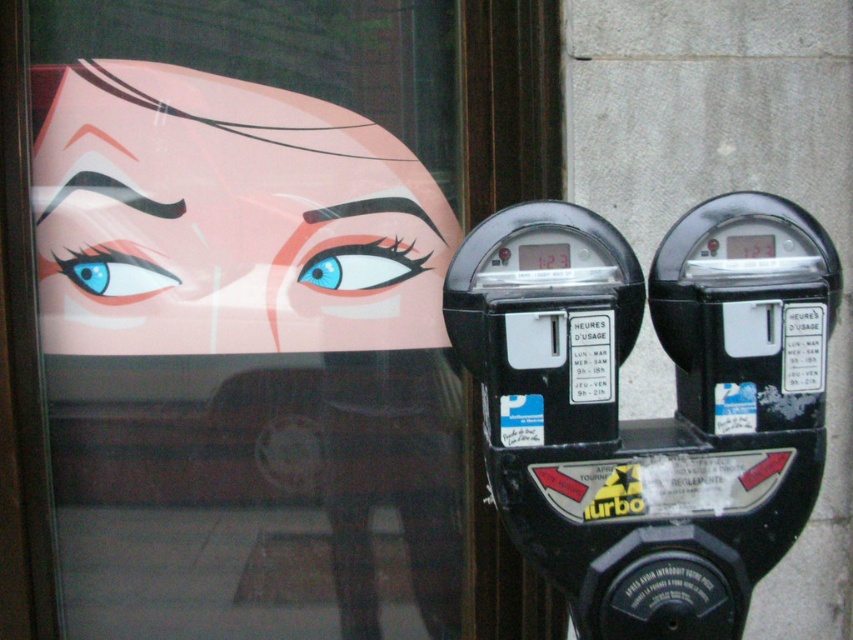
You are a delivery driver who needs to park between two black parking meters positioned side by side against a wall. The meters have digital displays showing 123 remaining. The meters also have a sticker with a blue P symbol and one with the word turbo. The transparent glass at upper left is between them. Can your 2.5 meter long van fit between them?

The distance between the two black parking meters positioned side by side against a wall is 2.69 meters, so yes, the van can fit as it is shorter than the space available.

You are a driver trying to park your car. You see the black plastic parking meter at right and the blue glossy eye at center. Which object is taller?

The black plastic parking meter at right is much taller than the blue glossy eye at center.